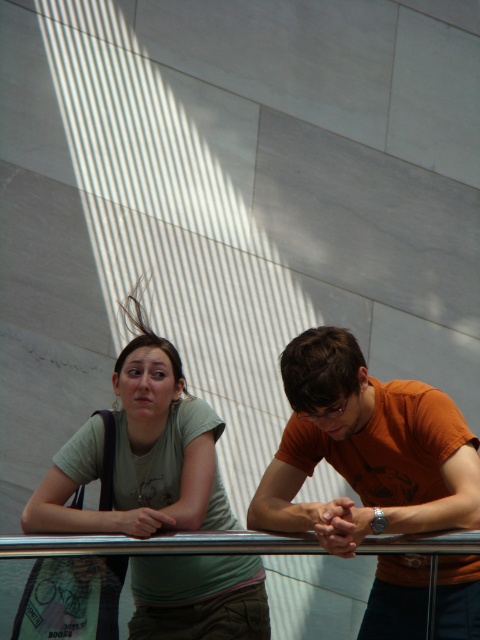
Based on the scene description, where is the orange cotton shirt at center located in terms of coordinates?

The orange cotton shirt at center is located at coordinates point (x=365, y=449).